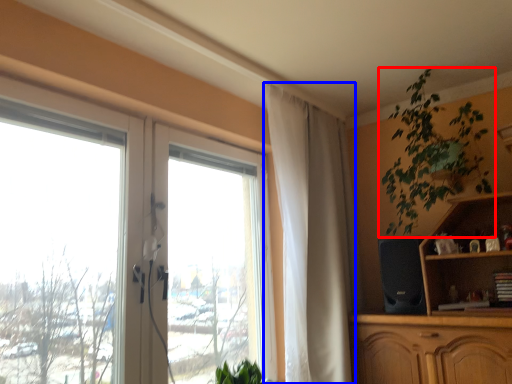
Question: Among these objects, which one is farthest to the camera, houseplant (highlighted by a red box) or curtain (highlighted by a blue box)?

Choices:
 (A) houseplant
 (B) curtain

Answer: (B)